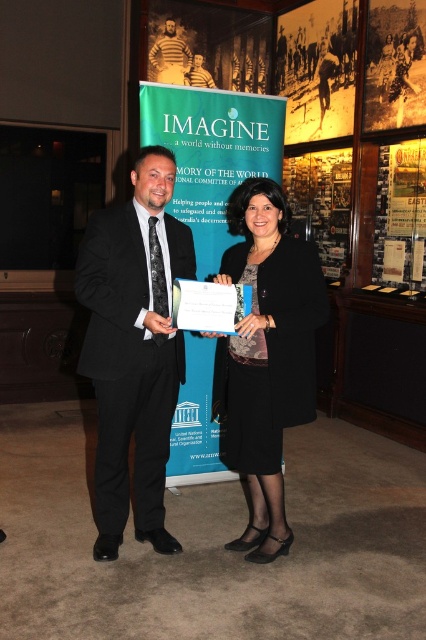
What is the spatial relationship between the blue paper at center and the metallic gold plaque at upper right in the image?

The blue paper at center is located below the metallic gold plaque at upper right.

What is the spatial relationship between the blue paper at center and the yellow paper at upper center in the scene?

The blue paper at center is located below the yellow paper at upper center.

What is the position of the point at coordinates (400, 216) in relation to the metallic gold plaque at upper right?

The point at coordinates (400, 216) is located on the metallic gold plaque at upper right.